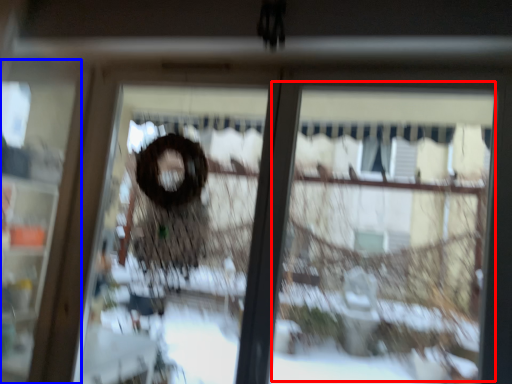
Question: Which of the following is the farthest to the observer, shop window (highlighted by a red box) or screen door (highlighted by a blue box)?

Choices:
 (A) shop window
 (B) screen door

Answer: (B)